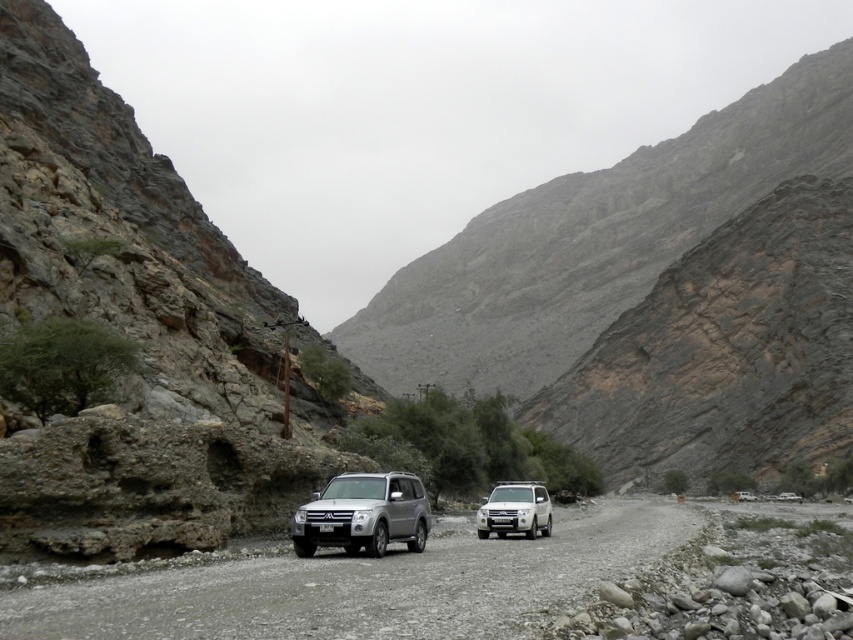
Question: Which of these objects is positioned closest to the black plastic license plate at center?

Choices:
 (A) silver metallic jeep at center
 (B) silver metallic suv at center

Answer: (B)

Question: Is silver metallic suv at center bigger than silver metallic jeep at center?

Choices:
 (A) yes
 (B) no

Answer: (B)

Question: Can you confirm if silver metallic suv at center is wider than silver metallic jeep at center?

Choices:
 (A) no
 (B) yes

Answer: (A)

Question: Among these objects, which one is farthest from the camera?

Choices:
 (A) gray gravel road at center
 (B) black plastic license plate at center
 (C) silver metallic jeep at center

Answer: (C)

Question: Which point is farther to the camera?

Choices:
 (A) silver metallic suv at center
 (B) silver metallic jeep at center
 (C) black plastic license plate at center
 (D) gray gravel road at center

Answer: (B)

Question: Does silver metallic suv at center have a larger size compared to silver metallic jeep at center?

Choices:
 (A) no
 (B) yes

Answer: (A)